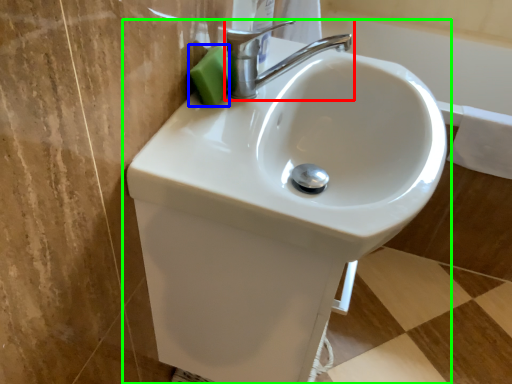
Question: Which object is the farthest from tap (highlighted by a red box)? Choose among these: soap (highlighted by a blue box) or sink (highlighted by a green box).

Choices:
 (A) soap
 (B) sink

Answer: (B)